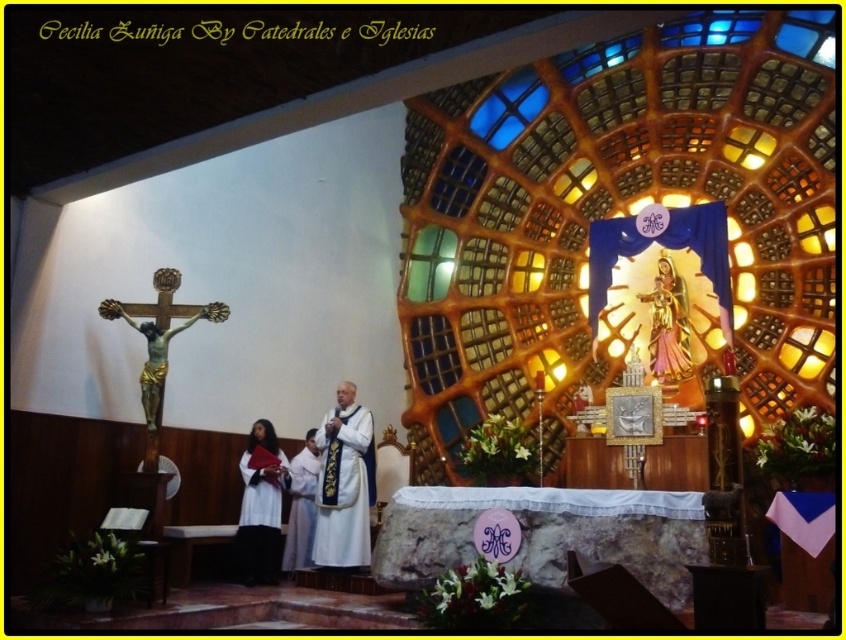
Does gold metallic statue at upper center lie in front of white clothed person at center?

That is False.

Is gold metallic statue at upper center positioned behind white clothed person at center?

Yes.

Where is `gold metallic statue at upper center`? This screenshot has height=640, width=846. gold metallic statue at upper center is located at coordinates (668, 324).

Who is higher up, white silk vestment at center or gold polished crucifix at left?

Positioned higher is gold polished crucifix at left.

Is point (333, 540) positioned in front of point (162, 364)?

No, it is behind (162, 364).

This screenshot has width=846, height=640. I want to click on white silk vestment at center, so click(344, 483).

Can you confirm if white silk vestment at center is positioned to the right of white clothed person at center?

Indeed, white silk vestment at center is positioned on the right side of white clothed person at center.

Which is behind, point (342, 420) or point (308, 516)?

The point (308, 516) is more distant.

Find the location of `white silk vestment at center`. white silk vestment at center is located at coordinates (344, 483).